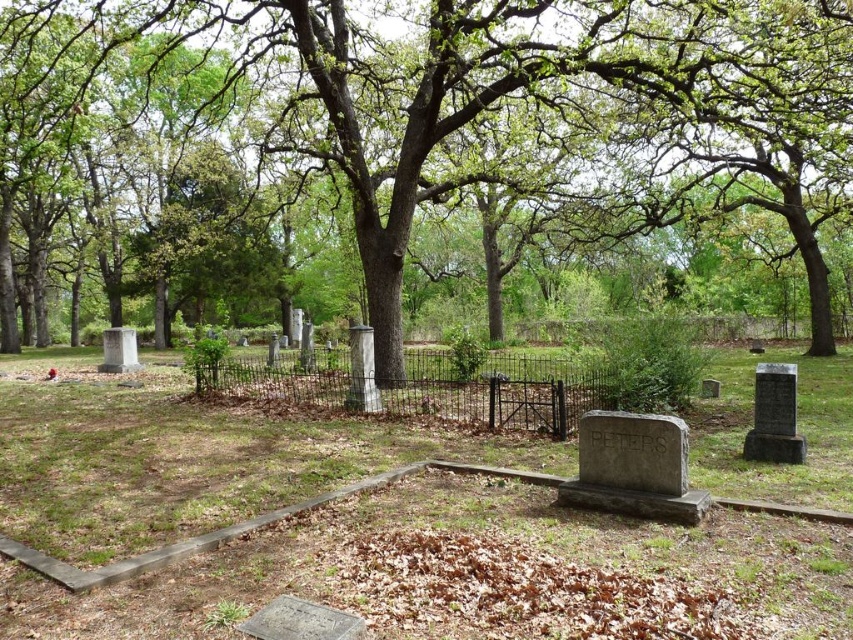
Question: Considering the real-world distances, which object is farthest from the green leafy tree at center?

Choices:
 (A) gray stone marker at center
 (B) black granite gravestone at center-right
 (C) gray stone gravestone at center
 (D) white marble gravestone at left

Answer: (D)

Question: Can you confirm if gray stone marker at center is bigger than gray stone gravestone at center?

Choices:
 (A) yes
 (B) no

Answer: (A)

Question: Which point appears closest to the camera in this image?

Choices:
 (A) (103, 371)
 (B) (447, 627)
 (C) (776, 365)
 (D) (531, 92)

Answer: (B)

Question: Is gray stone marker at center to the left of green leafy tree at center from the viewer's perspective?

Choices:
 (A) yes
 (B) no

Answer: (B)

Question: Is gray stone marker at center to the left of green leafy tree at center from the viewer's perspective?

Choices:
 (A) no
 (B) yes

Answer: (A)

Question: Which point is farther from the camera taking this photo?

Choices:
 (A) (409, 202)
 (B) (747, 474)
 (C) (650, 513)

Answer: (A)